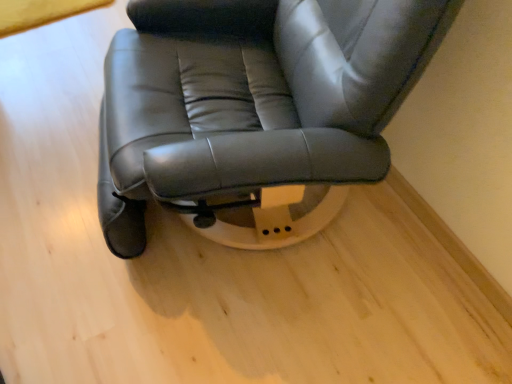
Image resolution: width=512 pixels, height=384 pixels. What are the coordinates of `free space in front of matte black chair at center` in the screenshot? It's located at (221, 329).